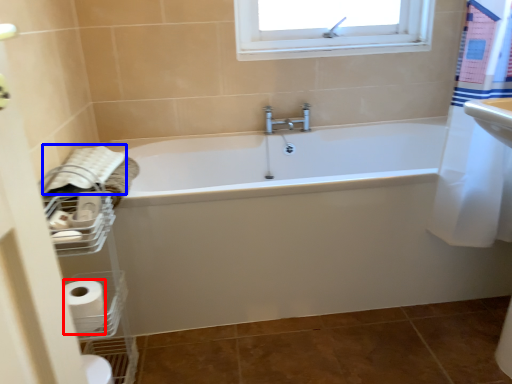
Question: Which point is further to the camera, toilet paper (highlighted by a red box) or bath towel (highlighted by a blue box)?

Choices:
 (A) toilet paper
 (B) bath towel

Answer: (B)